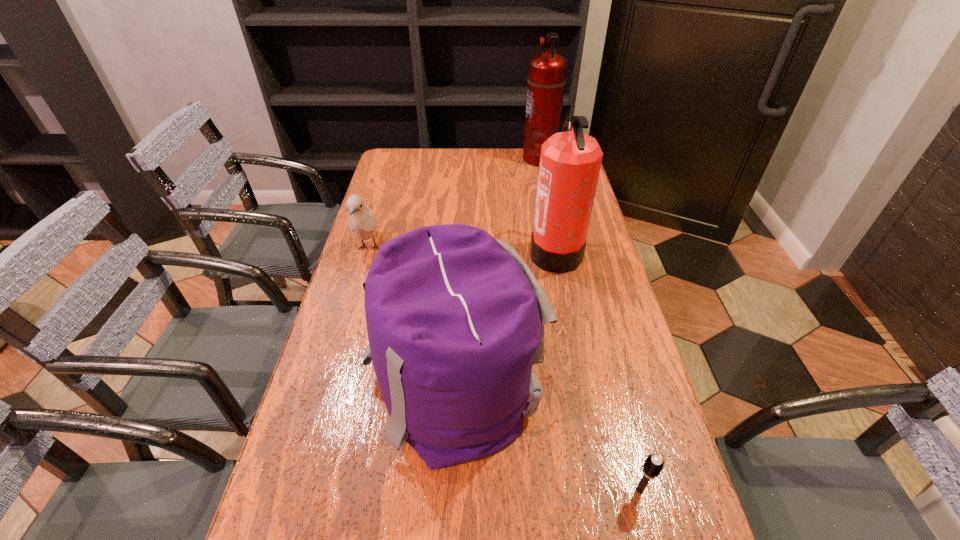
At what (x,y) coordinates should I click in order to perform the action: click on vacant space located 0.210m on the nozzle side of the farther fire extinguisher. Please return your answer as a coordinate pair (x, y). Looking at the image, I should click on (471, 158).

Locate an element on the screen. blank space located 0.300m on the front side of the nearer fire extinguisher is located at coordinates (436, 252).

Where is `vacant space located 0.080m on the front side of the nearer fire extinguisher`? The image size is (960, 540). vacant space located 0.080m on the front side of the nearer fire extinguisher is located at coordinates pyautogui.click(x=505, y=252).

The height and width of the screenshot is (540, 960). I want to click on free location located 0.050m on the front side of the nearer fire extinguisher, so click(515, 252).

At what (x,y) coordinates should I click in order to perform the action: click on vacant region located on the front pocket of the backpack. Please return your answer as a coordinate pair (x, y). This screenshot has height=540, width=960. Looking at the image, I should click on (591, 386).

Image resolution: width=960 pixels, height=540 pixels. I want to click on vacant position located at the beak of the second shortest object, so click(x=332, y=375).

The height and width of the screenshot is (540, 960). Find the location of `free location located on the left of the shortest object`. free location located on the left of the shortest object is located at coordinates (586, 490).

Locate an element on the screen. The width and height of the screenshot is (960, 540). object that is at the far edge is located at coordinates (546, 80).

Locate an element on the screen. The width and height of the screenshot is (960, 540). backpack that is at the left edge is located at coordinates (455, 319).

Identify the location of bird positioned at the left edge. This screenshot has width=960, height=540. (362, 220).